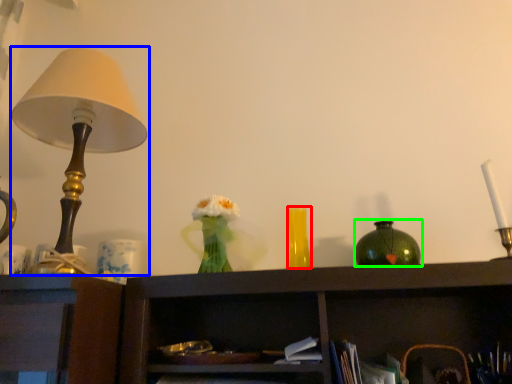
Question: Which is nearer to the vase (highlighted by a red box)? lamp (highlighted by a blue box) or vase (highlighted by a green box).

Choices:
 (A) lamp
 (B) vase

Answer: (B)